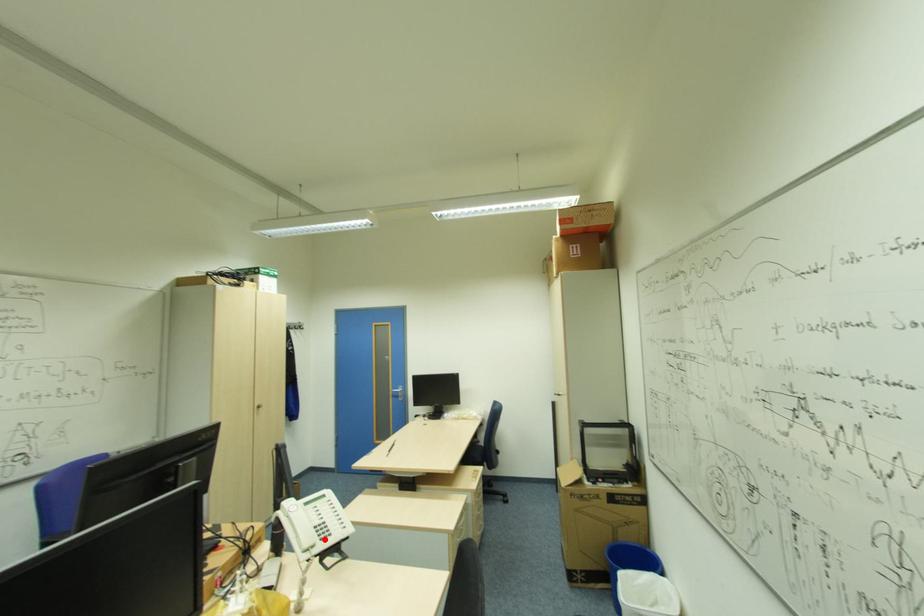
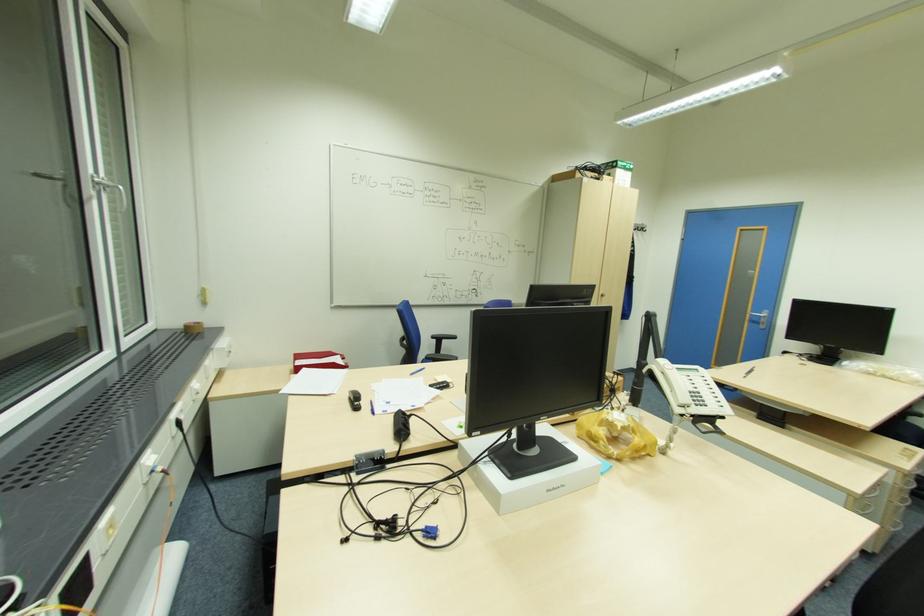
In the second image, find the point that corresponds to the highlighted location in the first image.

(699, 403)